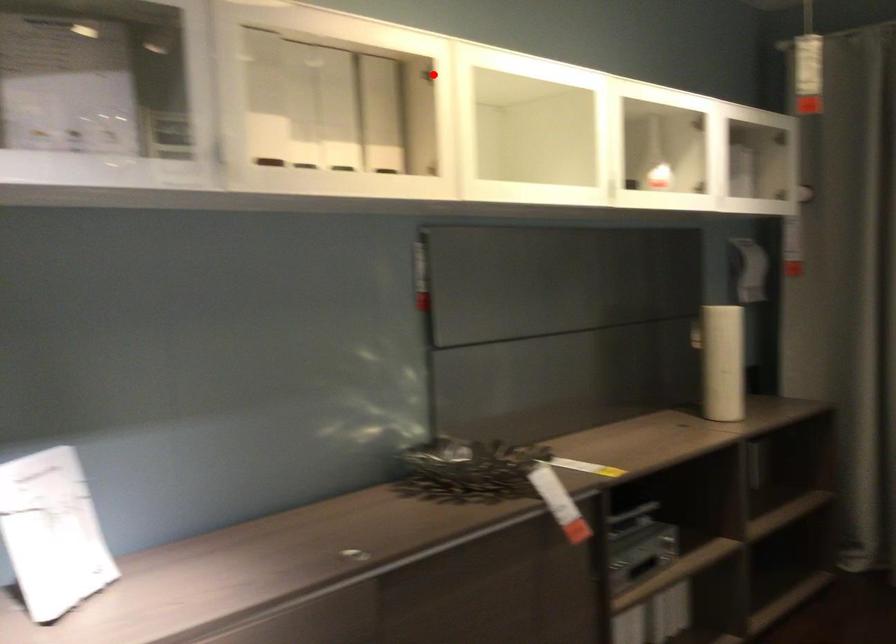
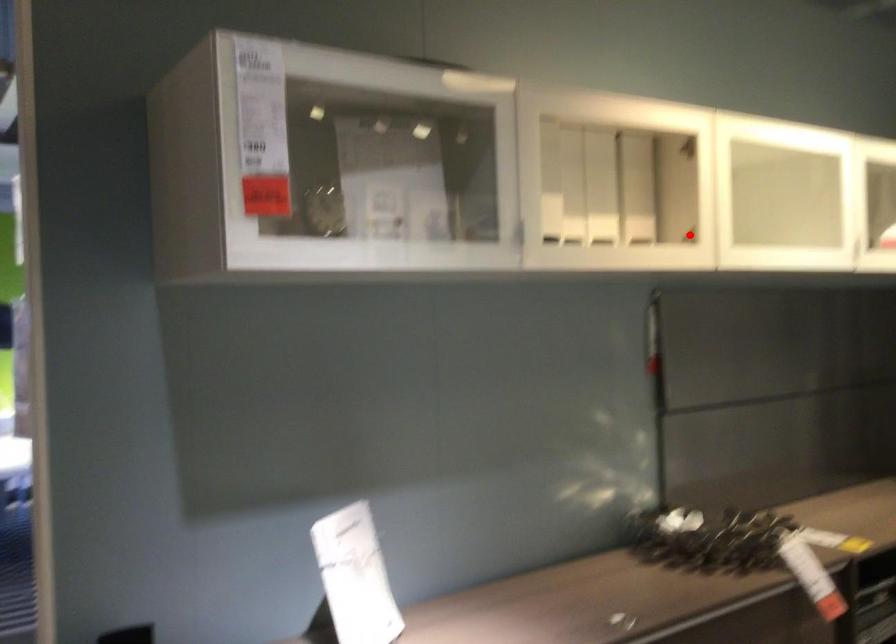
I am providing you with two images of the same scene from different viewpoints. A red point is marked on the first image and another point is marked on the second image. Is the red point in image1 aligned with the point shown in image2?

No